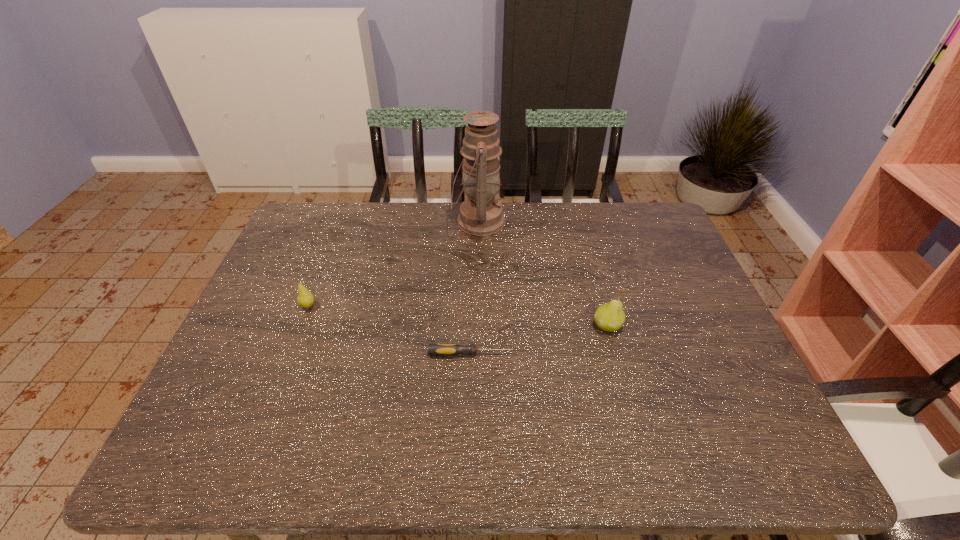
Identify which object is the nearest to the nearest object. Please provide its 2D coordinates. Your answer should be formatted as a tuple, i.e. [(x, y)], where the tuple contains the x and y coordinates of a point satisfying the conditions above.

[(610, 317)]

Identify which object is the nearest to the third farthest object. Please provide its 2D coordinates. Your answer should be formatted as a tuple, i.e. [(x, y)], where the tuple contains the x and y coordinates of a point satisfying the conditions above.

[(433, 349)]

You are a GUI agent. You are given a task and a screenshot of the screen. Output one action in this format:
    pyautogui.click(x=<x>, y=<y>)
    Task: Click on the free region that satisfies the following two spatial constraints: 1. on the front side of the oil lamp; 2. insert the nearest object into a screw head
    This screenshot has height=540, width=960.
    Given the screenshot: What is the action you would take?
    pyautogui.click(x=477, y=354)